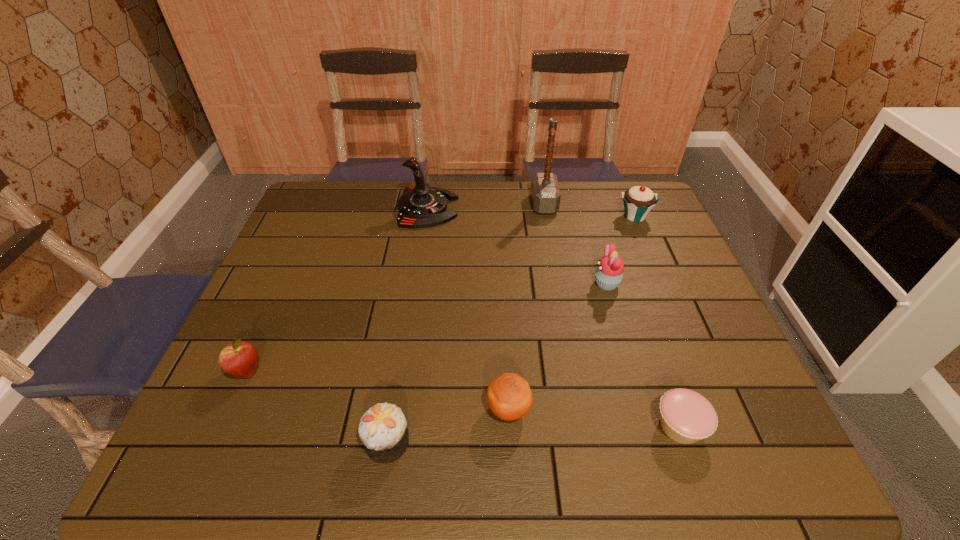
I want to click on free spot between the third tallest cupcake and the hammer, so click(x=466, y=323).

Where is `free spot between the joystick and the leftmost cupcake`? free spot between the joystick and the leftmost cupcake is located at coordinates (408, 325).

This screenshot has height=540, width=960. Identify the location of vacant area that lies between the shortest object and the hammer. (612, 315).

What are the coordinates of `free space between the shortest cupcake and the orange` in the screenshot? It's located at (594, 417).

This screenshot has width=960, height=540. What are the coordinates of `the fifth closest object to the second shortest cupcake` in the screenshot? It's located at (420, 206).

Select which object is the second closest to the leftmost cupcake. Please provide its 2D coordinates. Your answer should be formatted as a tuple, i.e. [(x, y)], where the tuple contains the x and y coordinates of a point satisfying the conditions above.

[(240, 359)]

Where is `the second closest cupcake relative to the apple`? Image resolution: width=960 pixels, height=540 pixels. the second closest cupcake relative to the apple is located at coordinates click(609, 273).

Locate which cupcake is the second closest to the fourth object from left to right. Please provide its 2D coordinates. Your answer should be formatted as a tuple, i.e. [(x, y)], where the tuple contains the x and y coordinates of a point satisfying the conditions above.

[(686, 417)]

The image size is (960, 540). What are the coordinates of `vacant region that satisfies the following two spatial constraints: 1. on the handle side of the joystick; 2. on the left side of the fifth object from right to left` in the screenshot? It's located at (398, 409).

Identify the location of free space in the image that satisfies the following two spatial constraints: 1. on the front side of the shortest object; 2. on the left side of the leftmost object. (223, 426).